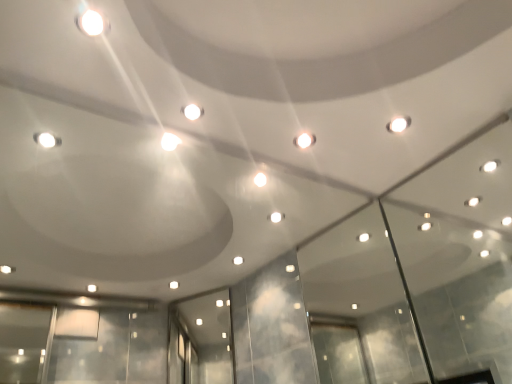
Question: Should I look upward or downward to see white glossy light at upper left?

Choices:
 (A) down
 (B) up

Answer: (B)